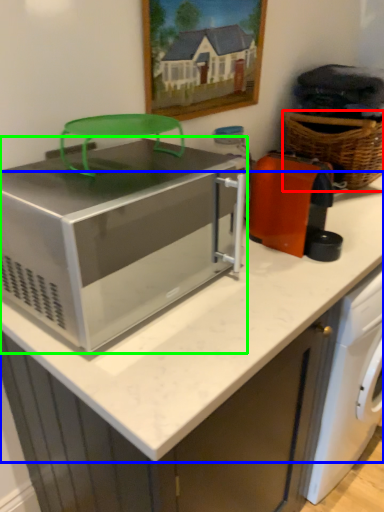
Question: Which object is the farthest from basket (highlighted by a red box)? Choose among these: counter top (highlighted by a blue box) or home appliance (highlighted by a green box).

Choices:
 (A) counter top
 (B) home appliance

Answer: (A)